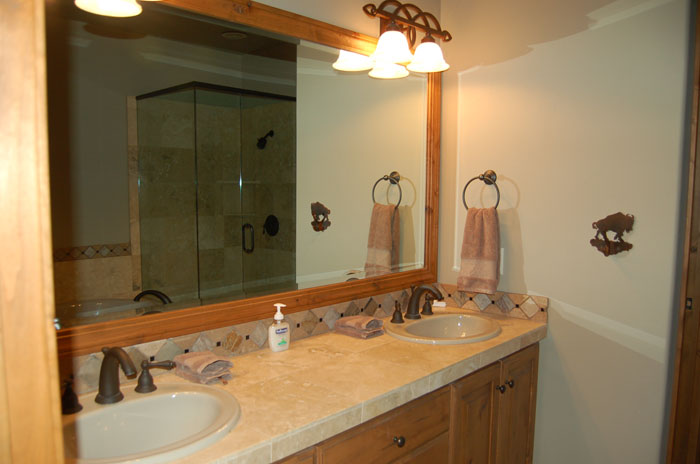
Find the location of a particular element. Image resolution: width=700 pixels, height=464 pixels. backsplash tiles is located at coordinates (242, 340).